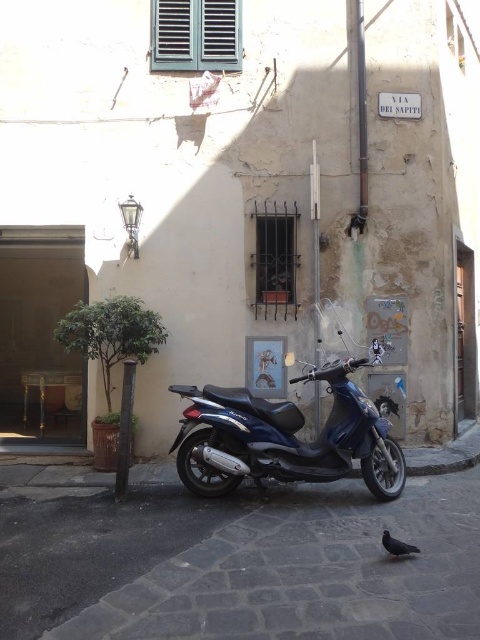
You are a delivery person who needs to load a package onto the shiny blue scooter at center and the dark gray feathered pigeon at lower right. Which object can you place the package on?

The shiny blue scooter at center is bigger than the dark gray feathered pigeon at lower right, so you can place the package on the shiny blue scooter at center.

You are standing at the camera position and want to reach the point marked at coordinates (295, 472). The scooter is parked on the right side of the frame against the wall. Is the point closer to you than the scooter?

The point marked at coordinates (295, 472) is 18.50 feet from the camera. Since the scooter is parked on the right side of the frame against the wall, it is closer to the camera than the point. Therefore, the point is farther away than the scooter.

You are a delivery person who needs to park your shiny blue scooter at center and a dark gray feathered pigeon at lower right in a narrow alley. The alley is only wide enough for one of them. Based on their sizes, which one can fit through the alley?

The shiny blue scooter at center is wider than the dark gray feathered pigeon at lower right. Therefore, the dark gray feathered pigeon at lower right can fit through the alley, but the shiny blue scooter at center cannot.